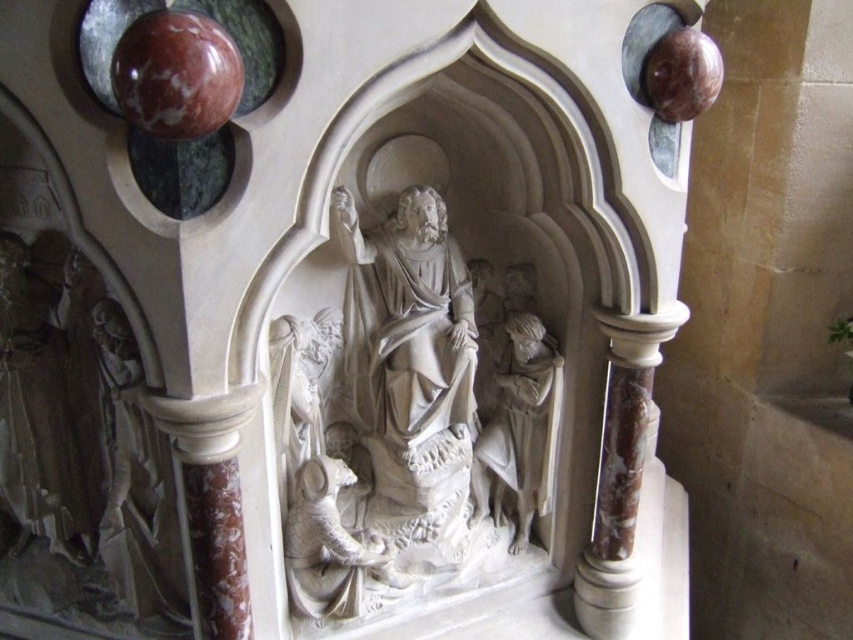
Question: Is white marble sculpture at center below white marble statue at center?

Choices:
 (A) yes
 (B) no

Answer: (B)

Question: Which point appears closest to the camera in this image?

Choices:
 (A) (515, 476)
 (B) (325, 342)

Answer: (B)

Question: Is white marble sculpture at center behind white marble statue at center?

Choices:
 (A) yes
 (B) no

Answer: (B)

Question: Is white marble sculpture at center positioned before white marble statue at center?

Choices:
 (A) no
 (B) yes

Answer: (B)

Question: Which object is closer to the camera taking this photo?

Choices:
 (A) white marble statue at center
 (B) white marble sculpture at center

Answer: (B)